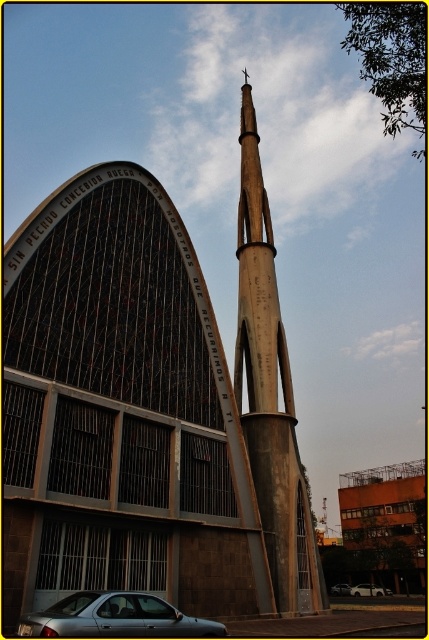
Is concrete steeple at center further to the viewer compared to satin silver sedan at center?

That is False.

Can you confirm if concrete steeple at center is positioned to the right of satin silver sedan at center?

Incorrect, concrete steeple at center is not on the right side of satin silver sedan at center.

Is point (145, 426) positioned behind point (344, 586)?

No, it is in front of (344, 586).

Where is `concrete steeple at center`? concrete steeple at center is located at coordinates (148, 406).

Is silver metallic car at lower left thinner than silver metallic car at center?

In fact, silver metallic car at lower left might be wider than silver metallic car at center.

Can you confirm if silver metallic car at lower left is positioned to the left of silver metallic car at center?

Indeed, silver metallic car at lower left is positioned on the left side of silver metallic car at center.

What do you see at coordinates (115, 618) in the screenshot? The width and height of the screenshot is (429, 640). I see `silver metallic car at lower left` at bounding box center [115, 618].

The image size is (429, 640). Find the location of `silver metallic car at lower left`. silver metallic car at lower left is located at coordinates click(115, 618).

In order to click on silver metallic car at lower left in this screenshot , I will do `click(115, 618)`.

Does silver metallic car at lower left appear over satin silver sedan at center?

Yes, silver metallic car at lower left is above satin silver sedan at center.

Who is more distant from viewer, (75,600) or (343,584)?

Point (343,584)

Where is `silver metallic car at lower left`? silver metallic car at lower left is located at coordinates (115, 618).